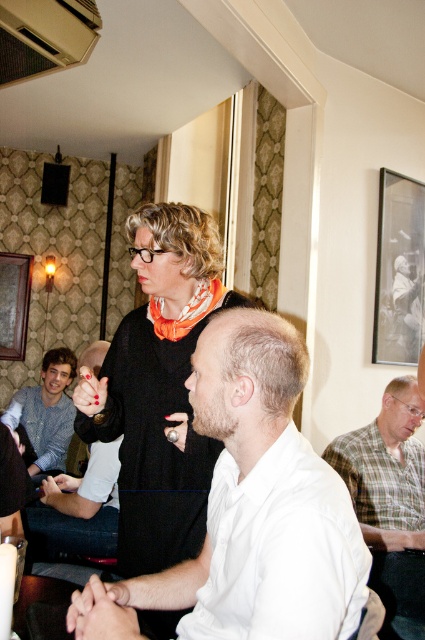
You are an interior designer assessing the layout of this space. You notice the black matte picture frame at upper right and the knitted sweater at left. Which object is located higher up in the image?

The black matte picture frame at upper right is positioned over the knitted sweater at left, meaning it is higher up in the image.

You are a photographer setting up a shoot in this room. You need to ensure that the white matte shirt at center is visible above the wooden picture frame at left. Based on their current positions, is this achievable?

The white matte shirt at center is shorter than the wooden picture frame at left, so it cannot be seen above the frame unless the shirt is raised or the frame lowered.